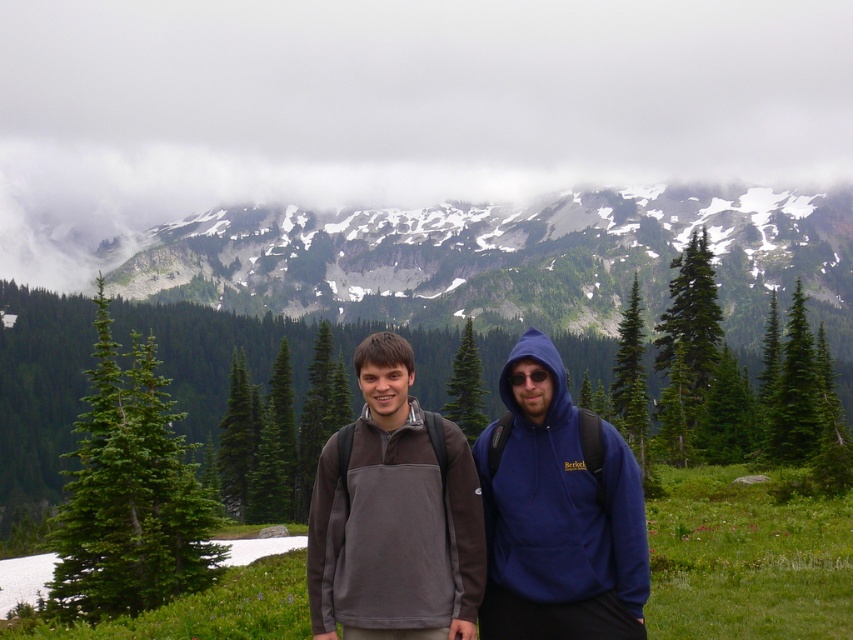
Between dark gray fleece at center and green matte pine at left, which one has more height?

green matte pine at left is taller.

Can you confirm if dark gray fleece at center is positioned above green matte pine at left?

Yes, dark gray fleece at center is above green matte pine at left.

Is point (628, 572) less distant than point (132, 589)?

Yes, point (628, 572) is in front of point (132, 589).

Image resolution: width=853 pixels, height=640 pixels. In order to click on dark gray fleece at center in this screenshot , I will do `click(483, 524)`.

Between white fluffy cloud at upper center and green matte pine at center, which one has less height?

With less height is green matte pine at center.

Between white fluffy cloud at upper center and green matte pine at center, which one is positioned higher?

white fluffy cloud at upper center is above.

This screenshot has height=640, width=853. What do you see at coordinates (396, 108) in the screenshot? I see `white fluffy cloud at upper center` at bounding box center [396, 108].

Find the location of a particular element. The width and height of the screenshot is (853, 640). white fluffy cloud at upper center is located at coordinates (396, 108).

Can you confirm if white fluffy cloud at upper center is smaller than dark gray fleece at center?

No.

Which is in front, point (347, 81) or point (581, 490)?

Point (581, 490) is in front.

Describe the element at coordinates (396, 108) in the screenshot. I see `white fluffy cloud at upper center` at that location.

This screenshot has height=640, width=853. In order to click on white fluffy cloud at upper center in this screenshot , I will do `click(396, 108)`.